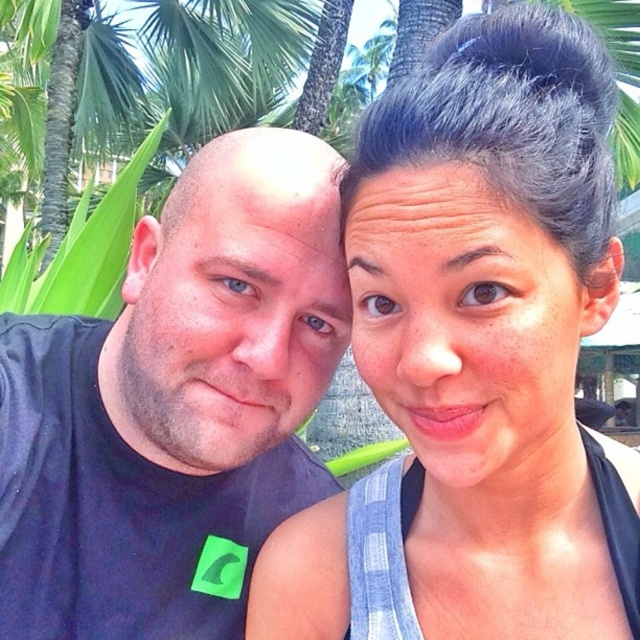
Question: Estimate the real-world distances between objects in this image. Which object is farther from the blue plaid shirt at upper right?

Choices:
 (A) matte skin face at left
 (B) smooth skin face at center
 (C) smooth bald head at center
 (D) black matte t-shirt at left

Answer: (C)

Question: Is smooth skin face at center below matte skin face at left?

Choices:
 (A) no
 (B) yes

Answer: (B)

Question: Does smooth skin face at center appear on the left side of smooth bald head at center?

Choices:
 (A) no
 (B) yes

Answer: (A)

Question: Which point is closer to the camera taking this photo?

Choices:
 (A) (426, 369)
 (B) (508, 356)
 (C) (291, 211)
 (D) (324, 317)

Answer: (A)

Question: Which point is farther from the camera taking this photo?

Choices:
 (A) (268, 221)
 (B) (531, 323)
 (C) (120, 572)
 (D) (506, 284)

Answer: (C)

Question: Can you confirm if black matte t-shirt at left is positioned above smooth skin face at center?

Choices:
 (A) yes
 (B) no

Answer: (A)